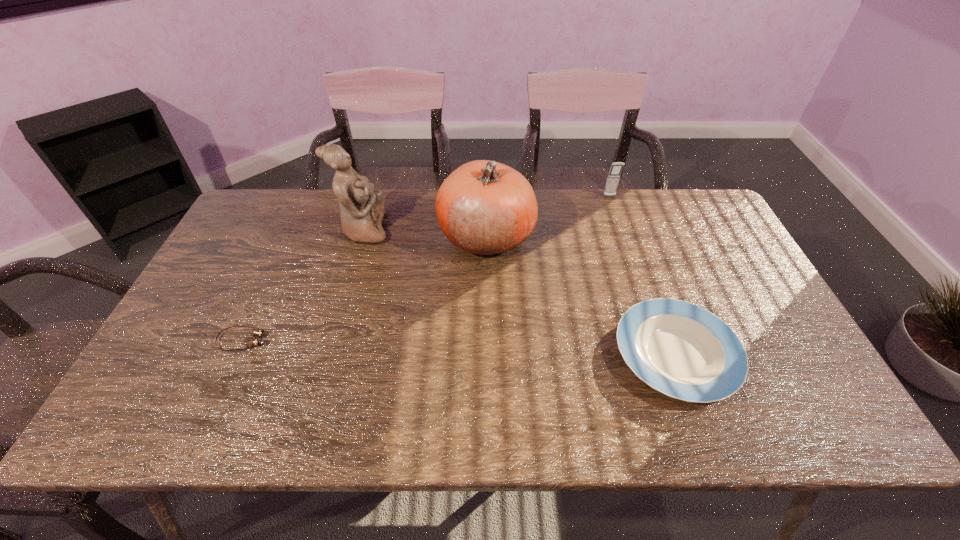
At what (x,y) coordinates should I click in order to perform the action: click on blank space that satisfies the following two spatial constraints: 1. on the front-facing side of the figurine; 2. on the left side of the fourth tallest object. Please return your answer as a coordinate pair (x, y). Looking at the image, I should click on (328, 354).

I want to click on vacant area in the image that satisfies the following two spatial constraints: 1. on the back side of the pumpkin; 2. on the front-facing side of the second object from left to right, so click(486, 230).

Identify the location of free space that satisfies the following two spatial constraints: 1. on the front-facing side of the figurine; 2. on the back side of the pumpkin. Image resolution: width=960 pixels, height=540 pixels. (362, 235).

The width and height of the screenshot is (960, 540). I want to click on free spot that satisfies the following two spatial constraints: 1. on the front-facing side of the third tallest object; 2. on the front lenses and sides of the leftmost object, so click(x=659, y=340).

Locate an element on the screen. The height and width of the screenshot is (540, 960). vacant space that satisfies the following two spatial constraints: 1. on the front-facing side of the cellular telephone; 2. on the front-facing side of the fourth object from right to left is located at coordinates [621, 230].